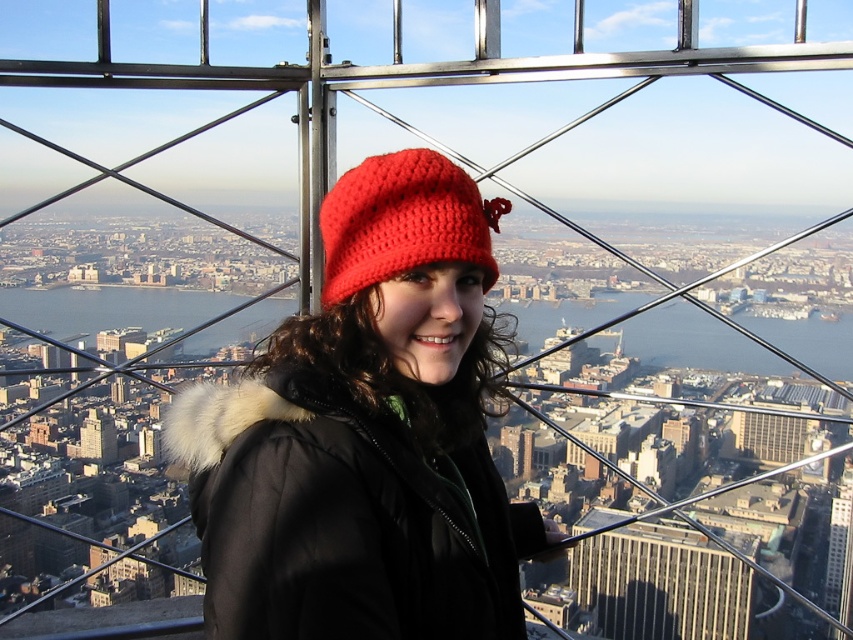
You are taking a photo of the crochet knit hat at center and the matte beige building at center. Which object will appear larger in the photo?

The crochet knit hat at center will appear larger in the photo because it is closer to the viewer than the matte beige building at center.

You are a city planner reviewing this area and want to ensure that the matte beige building at center and the metallic glass skyscraper at center are positioned correctly according to zoning laws. Based on their vertical placement, which one is situated lower in the scene?

The matte beige building at center is located below the metallic glass skyscraper at center, so it is situated lower in the scene.